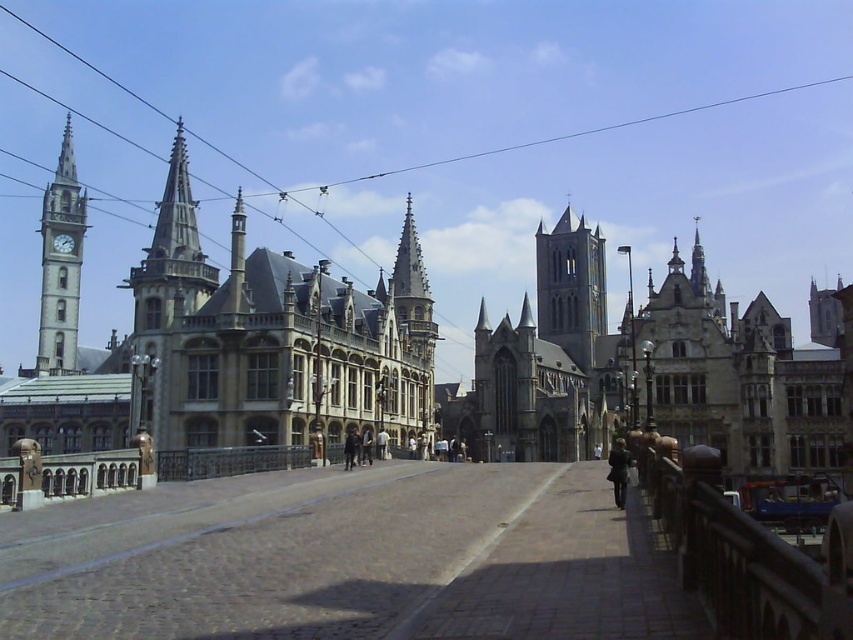
Question: Which object is positioned farthest from the brown stone church at center?

Choices:
 (A) stone gothic church at left
 (B) smooth gray stone tower at center

Answer: (A)

Question: Where is brown stone church at center located in relation to matte gray clock tower at left in the image?

Choices:
 (A) right
 (B) left

Answer: (A)

Question: Among these points, which one is nearest to the camera?

Choices:
 (A) (450, 397)
 (B) (56, 246)

Answer: (A)

Question: Is matte gray clock tower at left above matte gray clock at left?

Choices:
 (A) yes
 (B) no

Answer: (B)

Question: From the image, what is the correct spatial relationship of black wire at upper center in relation to dark brown leather coat at center?

Choices:
 (A) below
 (B) above

Answer: (B)

Question: Based on their relative distances, which object is farther from the brown stone church at center?

Choices:
 (A) matte gray clock tower at left
 (B) smooth stone spire at center-left
 (C) black wire at upper center
 (D) stone gothic church at left

Answer: (A)